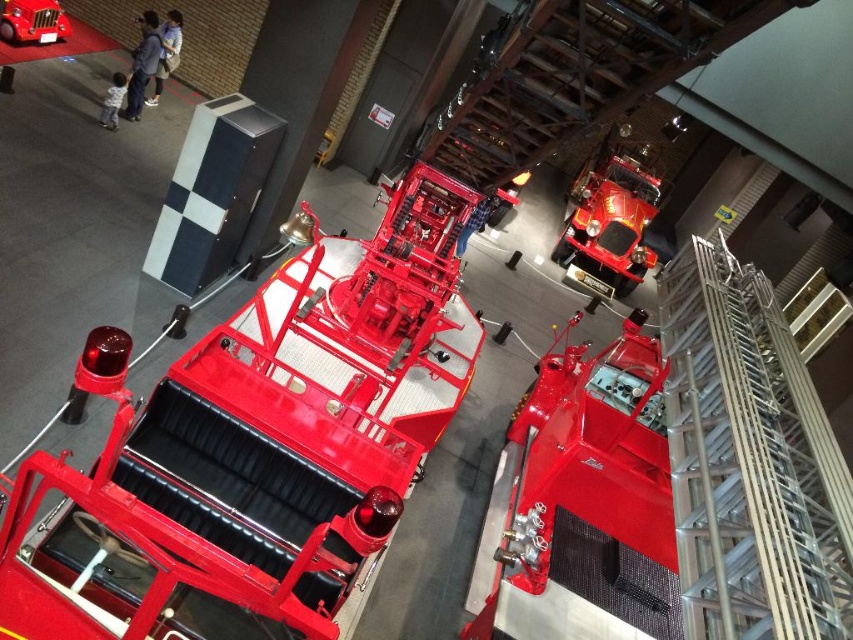
Is glossy metal fire truck at center shorter than metallic silver ladder at center right?

Yes.

Is glossy metal fire truck at center smaller than metallic silver ladder at center right?

Yes, glossy metal fire truck at center is smaller than metallic silver ladder at center right.

Is point (717, 580) farther from camera compared to point (779, 317)?

No, (717, 580) is closer to viewer.

Where is `glossy metal fire truck at center`? This screenshot has height=640, width=853. glossy metal fire truck at center is located at coordinates (672, 483).

Locate an element on the screen. The image size is (853, 640). glossy metal fire truck at center is located at coordinates (672, 483).

Is point (810, 609) farther from camera compared to point (28, 35)?

No, it is not.

You are a GUI agent. You are given a task and a screenshot of the screen. Output one action in this format:
    pyautogui.click(x=<x>, y=<y>)
    Task: Click on the glossy metal fire truck at center
    
    Given the screenshot: What is the action you would take?
    pyautogui.click(x=672, y=483)

Is point (154, 636) farther from viewer compared to point (631, 170)?

No.

Between glossy red fire truck at center and glossy red fire truck at upper right, which one is positioned higher?

glossy red fire truck at upper right is above.

Find the location of a particular element. The height and width of the screenshot is (640, 853). glossy red fire truck at center is located at coordinates coord(260,444).